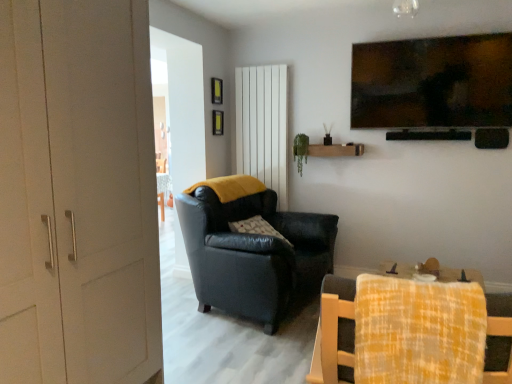
Question: Visually, is white vertical panel at center positioned to the left or to the right of leather armchair at center, which ranks as the 1th chair in back-to-front order?

Choices:
 (A) left
 (B) right

Answer: (B)

Question: Is white vertical panel at center in front of or behind leather armchair at center, which ranks as the 1th chair in back-to-front order, in the image?

Choices:
 (A) behind
 (B) front

Answer: (A)

Question: Which is nearer to the yellow plaid fabric at lower right, which is the first chair in front-to-back order?

Choices:
 (A) plush gray pillow at center
 (B) leather armchair at center, which ranks as the 1th chair in back-to-front order
 (C) white vertical panel at center
 (D) white matte door at left

Answer: (D)

Question: Which object is the farthest from the white vertical panel at center?

Choices:
 (A) white matte door at left
 (B) leather armchair at center, which ranks as the second chair in front-to-back order
 (C) plush gray pillow at center
 (D) yellow plaid fabric at lower right, which is the first chair in front-to-back order

Answer: (D)